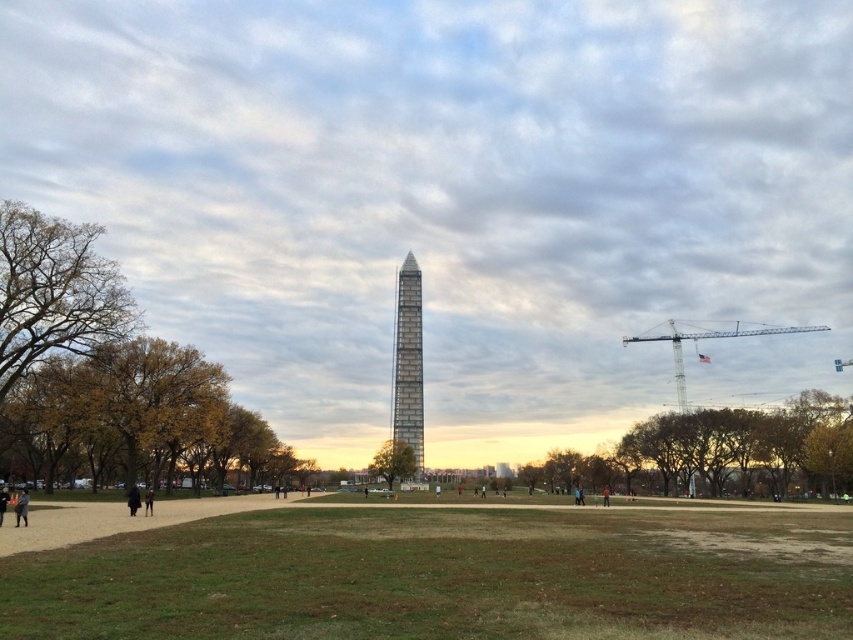
Question: Is green leafy tree at center behind dark gray jacket at lower left?

Choices:
 (A) yes
 (B) no

Answer: (A)

Question: Which point is farther from the camera taking this photo?

Choices:
 (A) (20, 460)
 (B) (749, 476)
 (C) (112, 275)

Answer: (B)

Question: Is brown leafy tree at left wider than black matte coat at lower left?

Choices:
 (A) no
 (B) yes

Answer: (A)

Question: Is yellow-green leaves at left closer to camera compared to black matte coat at lower left?

Choices:
 (A) no
 (B) yes

Answer: (A)

Question: Which object appears closest to the camera in this image?

Choices:
 (A) yellow-green leaves at left
 (B) white metallic crane at upper right

Answer: (A)

Question: Which point is farther to the camera?

Choices:
 (A) glassy gray tower at center
 (B) brown leafy tree at center
 (C) green leafy tree at center

Answer: (A)